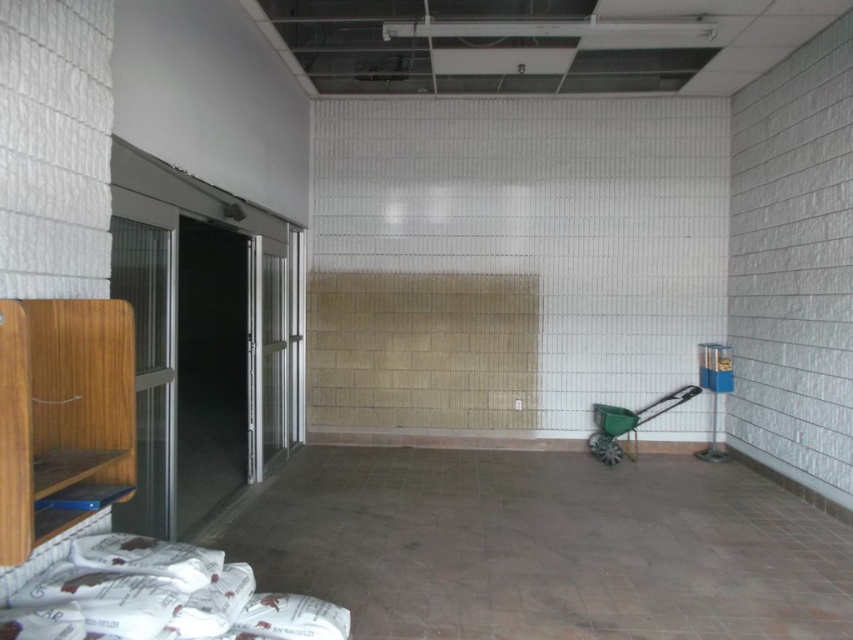
Based on the photo, you are a delivery person who needs to move a large box from the entrance to the storage area. The entrance is near the double glass doors on the left. You see the brown concrete floor at lower center and the green plastic wheelbarrow at lower right. Which direction should you move the box to reach the storage area near the wheelbarrow?

You should move the box to the right towards the green plastic wheelbarrow at lower right because the brown concrete floor at lower center is to the left of it, indicating the wheelbarrow is positioned further right in the space.

You are standing in the middle of the room and want to move towards the point closer to the camera between point [590,531] and point [669,394]. Which point should you move towards?

You should move towards point [590,531] because it is closer to the camera than point [669,394] according to the description.

You are a delivery person who just arrived with a package that needs to be placed on the brown concrete floor at lower center. However, there is a green plastic wheelbarrow at lower right in the way. Can you move the package to the floor without moving the wheelbarrow? Explain your reasoning based on the distance between them.

The brown concrete floor at lower center and the green plastic wheelbarrow at lower right are 5.50 feet apart. Since the distance between them is sufficient, you can move the package to the floor without needing to move the wheelbarrow as there is enough space between them.